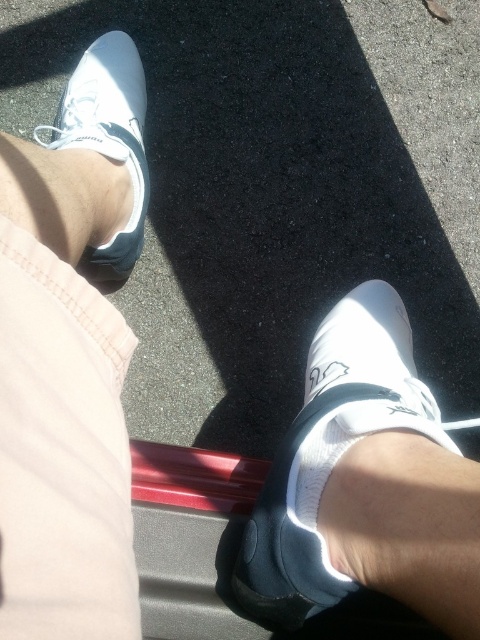
You are a photographer trying to capture both the white matte shoe at lower center and the white matte shoe at upper left in a single shot. Based on their positions, which shoe is closer to the camera?

The white matte shoe at lower center is positioned under the white matte shoe at upper left, meaning it is closer to the camera.

You are a delivery robot that needs to place a package between the two white matte shoes. The package is 15 inches long. Can you fit the package between the white matte shoe at lower center and the white matte shoe at upper left without overlapping either shoe?

The distance between the white matte shoe at lower center and the white matte shoe at upper left is 16.29 inches. Since the package is 15 inches long, it can fit between them without overlapping either shoe.

You are a photographer trying to capture both white matte shoes in the frame. Since the white matte shoe at lower center and the white matte shoe at upper left are positioned differently, which one is closer to the camera?

The white matte shoe at lower center is closer to the camera because it is in front of the white matte shoe at upper left.